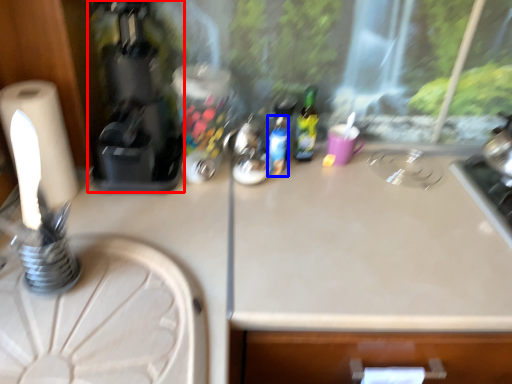
Question: Which object appears closest to the camera in this image, coffee machine (highlighted by a red box) or bottle (highlighted by a blue box)?

Choices:
 (A) coffee machine
 (B) bottle

Answer: (A)